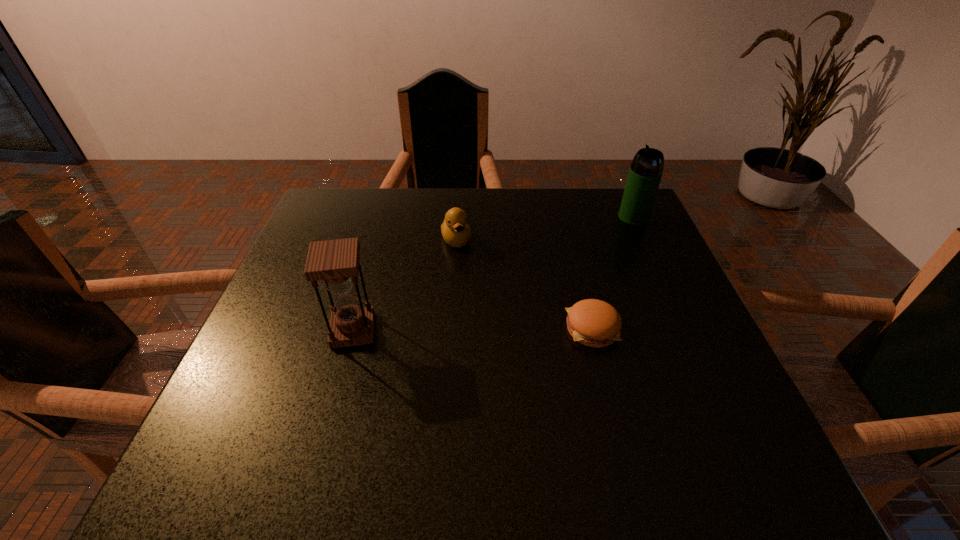
Locate an element on the screen. vacant region at the far edge of the desktop is located at coordinates (580, 212).

The height and width of the screenshot is (540, 960). Find the location of `vacant space at the near edge of the desktop`. vacant space at the near edge of the desktop is located at coordinates (383, 418).

I want to click on vacant space at the left edge, so click(302, 359).

The height and width of the screenshot is (540, 960). Identify the location of free space at the right edge. (624, 329).

Image resolution: width=960 pixels, height=540 pixels. In order to click on free space at the far left corner of the desktop in this screenshot , I will do `click(346, 204)`.

Locate an element on the screen. The height and width of the screenshot is (540, 960). vacant point at the near right corner is located at coordinates (741, 418).

The width and height of the screenshot is (960, 540). I want to click on vacant area between the shortest object and the rightmost object, so click(x=613, y=273).

This screenshot has height=540, width=960. What are the coordinates of `free space between the duckling and the leftmost object` in the screenshot? It's located at (405, 285).

Image resolution: width=960 pixels, height=540 pixels. Identify the location of free space between the rightmost object and the third object from left to right. (613, 273).

The height and width of the screenshot is (540, 960). I want to click on empty space that is in between the rightmost object and the patty, so click(x=613, y=273).